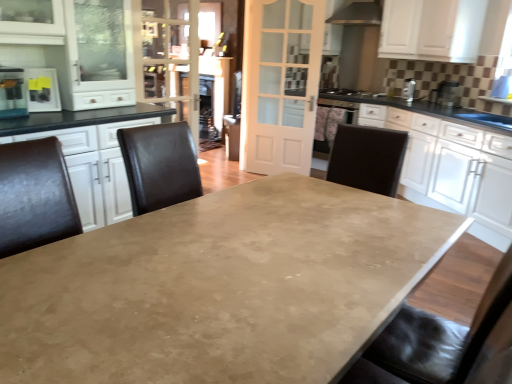
Identify the location of black leather chairs at left. The image size is (512, 384). pos(91,154).

Locate an element on the screen. metallic silver toaster at upper right, the second appliance when ordered from bottom to top is located at coordinates (446, 94).

What do you see at coordinates (445, 343) in the screenshot? This screenshot has height=384, width=512. I see `black leather swivel chair at right` at bounding box center [445, 343].

Image resolution: width=512 pixels, height=384 pixels. Find the location of `metallic stainless steel at upper center`. metallic stainless steel at upper center is located at coordinates (358, 14).

Does white matte cabinet at upper right, positioned as the second cabinetry in bottom-to-top order, appear on the right side of metallic silver refrigerator at upper left?

Indeed, white matte cabinet at upper right, positioned as the second cabinetry in bottom-to-top order, is positioned on the right side of metallic silver refrigerator at upper left.

This screenshot has height=384, width=512. What are the coordinates of `cabinetry above the metallic silver refrigerator at upper left (from a real-world perspective)` in the screenshot? It's located at (432, 30).

From a real-world perspective, which object stands above the other?

In real-world perspective, white matte cabinet at upper right, acting as the first cabinetry starting from the top, is above.

Which of these two, white matte cabinet at upper right, positioned as the second cabinetry in bottom-to-top order, or metallic silver refrigerator at upper left, is thinner?

With smaller width is metallic silver refrigerator at upper left.

Measure the distance from black leather swivel chair at right to metallic stainless steel at upper center.

black leather swivel chair at right is 15.81 feet away from metallic stainless steel at upper center.

Can you see black leather swivel chair at right touching metallic stainless steel at upper center?

No, black leather swivel chair at right is not making contact with metallic stainless steel at upper center.

From the image's perspective, is black leather swivel chair at right above metallic stainless steel at upper center?

Incorrect, from the image's perspective, black leather swivel chair at right is lower than metallic stainless steel at upper center.

From the picture: Is black leather swivel chair at right oriented towards metallic stainless steel at upper center?

No.

Locate an element on the screen. The image size is (512, 384). gas stove lying on the left of white matte cabinet at upper right, acting as the first cabinetry starting from the top is located at coordinates (344, 92).

From a real-world perspective, is black matte gas stove at upper right on top of white matte cabinet at upper right, acting as the first cabinetry starting from the top?

No, from a real-world perspective, black matte gas stove at upper right is not above white matte cabinet at upper right, acting as the first cabinetry starting from the top.

Does black matte gas stove at upper right have a lesser height compared to white matte cabinet at upper right, positioned as the second cabinetry in bottom-to-top order?

Yes.

Looking at this image, is black matte gas stove at upper right facing towards white matte cabinet at upper right, positioned as the second cabinetry in bottom-to-top order?

No, black matte gas stove at upper right is not turned towards white matte cabinet at upper right, positioned as the second cabinetry in bottom-to-top order.

Considering the positions of point (369, 10) and point (496, 145), is point (369, 10) closer or farther from the camera than point (496, 145)?

Point (369, 10) is positioned farther from the camera compared to point (496, 145).

Between metallic stainless steel at upper center and white glossy cabinet at right, which appears as the 1th cabinetry when ordered from the bottom, which one appears on the right side from the viewer's perspective?

white glossy cabinet at right, which appears as the 1th cabinetry when ordered from the bottom, is more to the right.

Is metallic stainless steel at upper center far from white glossy cabinet at right, marked as the second cabinetry in a top-to-bottom arrangement?

Absolutely, metallic stainless steel at upper center is distant from white glossy cabinet at right, marked as the second cabinetry in a top-to-bottom arrangement.

Considering the positions of objects black leather swivel chair at right and black matte gas stove at upper right in the image provided, who is more to the left, black leather swivel chair at right or black matte gas stove at upper right?

black leather swivel chair at right.

Is the depth of black leather swivel chair at right greater than that of black matte gas stove at upper right?

That is False.

Is black matte gas stove at upper right inside black leather swivel chair at right?

No.

Considering the relative sizes of black leather swivel chair at right and black matte gas stove at upper right in the image provided, is black leather swivel chair at right wider than black matte gas stove at upper right?

Yes, black leather swivel chair at right is wider than black matte gas stove at upper right.

Is point (6, 71) less distant than point (112, 193)?

Yes, it is.

Measure the distance between metallic silver refrigerator at upper left and black leather chairs at left.

A distance of 18.27 inches exists between metallic silver refrigerator at upper left and black leather chairs at left.

From the image's perspective, is metallic silver refrigerator at upper left above or below black leather chairs at left?

From the image's perspective, metallic silver refrigerator at upper left appears above black leather chairs at left.

Between metallic silver refrigerator at upper left and black leather chairs at left, which one is positioned behind?

metallic silver refrigerator at upper left is behind.

Which is in front, matte concrete table at center or metallic silver toaster at upper right, the 1th appliance positioned from the top?

matte concrete table at center is more forward.

Is matte concrete table at center completely or partially outside of metallic silver toaster at upper right, which appears as the second appliance when viewed from the left?

matte concrete table at center is positioned outside metallic silver toaster at upper right, which appears as the second appliance when viewed from the left.

This screenshot has width=512, height=384. Find the location of `the 1st appliance directly above the matte concrete table at center (from a real-world perspective)`. the 1st appliance directly above the matte concrete table at center (from a real-world perspective) is located at coordinates (408, 89).

Considering the positions of objects matte concrete table at center and metallic silver toaster at upper right, the 1th appliance positioned from the top, in the image provided, who is more to the left, matte concrete table at center or metallic silver toaster at upper right, the 1th appliance positioned from the top,?

From the viewer's perspective, matte concrete table at center appears more on the left side.

This screenshot has height=384, width=512. Find the location of `kitchen appliance located below the white matte cabinet at upper right, acting as the first cabinetry starting from the top (from the image's perspective)`. kitchen appliance located below the white matte cabinet at upper right, acting as the first cabinetry starting from the top (from the image's perspective) is located at coordinates (12, 93).

You are a GUI agent. You are given a task and a screenshot of the screen. Output one action in this format:
    pyautogui.click(x=<x>, y=<y>)
    Task: Click on the exhaust hood that is on the right side of black leather swivel chair at right
    This screenshot has width=512, height=384.
    Given the screenshot: What is the action you would take?
    pyautogui.click(x=358, y=14)

From the image, which object appears to be nearer to matte concrete table at center, metallic silver refrigerator at upper left or matte black toaster at left, the 3th appliance positioned from the top?

metallic silver refrigerator at upper left is closer to matte concrete table at center.

Based on their spatial positions, is white matte cabinet at upper right, positioned as the second cabinetry in bottom-to-top order, or black leather swivel chair at right further from metallic silver toaster at upper right, the second appliance from the front?

black leather swivel chair at right is further to metallic silver toaster at upper right, the second appliance from the front.

Estimate the real-world distances between objects in this image. Which object is closer to matte concrete table at center, metallic silver toaster at upper right, which appears as the second appliance when viewed from the left, or clear glass door at upper center?

Among the two, clear glass door at upper center is located nearer to matte concrete table at center.

When comparing their distances from metallic silver refrigerator at upper left, does white matte cabinet at upper right, acting as the first cabinetry starting from the top, or matte concrete table at center seem closer?

The object closer to metallic silver refrigerator at upper left is matte concrete table at center.

Based on their spatial positions, is white glass door at center or matte black toaster at left, marked as the third appliance in a right-to-left arrangement, closer to clear glass door at upper center?

Among the two, white glass door at center is located nearer to clear glass door at upper center.

From the image, which object appears to be farther from metallic silver toaster at upper right, which appears as the third appliance when viewed from the front, white matte cabinet at upper right, positioned as the second cabinetry in bottom-to-top order, or white glass door at center?

white glass door at center is further to metallic silver toaster at upper right, which appears as the third appliance when viewed from the front.

Which object lies nearer to the anchor point white glass door at center, metallic stainless steel at upper center or metallic silver refrigerator at upper left?

metallic stainless steel at upper center lies closer to white glass door at center than the other object.

When comparing their distances from white glossy cabinet at right, which appears as the 1th cabinetry when ordered from the bottom, does white matte cabinet at upper right, positioned as the second cabinetry in bottom-to-top order, or clear glass door at upper center seem closer?

white matte cabinet at upper right, positioned as the second cabinetry in bottom-to-top order, lies closer to white glossy cabinet at right, which appears as the 1th cabinetry when ordered from the bottom, than the other object.

This screenshot has width=512, height=384. What are the coordinates of `glass door between metallic silver refrigerator at upper left and metallic stainless steel at upper center from left to right` in the screenshot? It's located at (170, 57).

Locate an element on the screen. The height and width of the screenshot is (384, 512). exhaust hood between matte black toaster at left, the 3th appliance positioned from the top, and white glossy cabinet at right, marked as the second cabinetry in a top-to-bottom arrangement, from left to right is located at coordinates (358, 14).

This screenshot has width=512, height=384. What are the coordinates of `kitchen appliance between matte concrete table at center and metallic stainless steel at upper center along the z-axis` in the screenshot? It's located at (12, 93).

Identify the location of cabinetry between metallic stainless steel at upper center and white glossy cabinet at right, marked as the second cabinetry in a top-to-bottom arrangement, vertically. The image size is (512, 384). (432, 30).